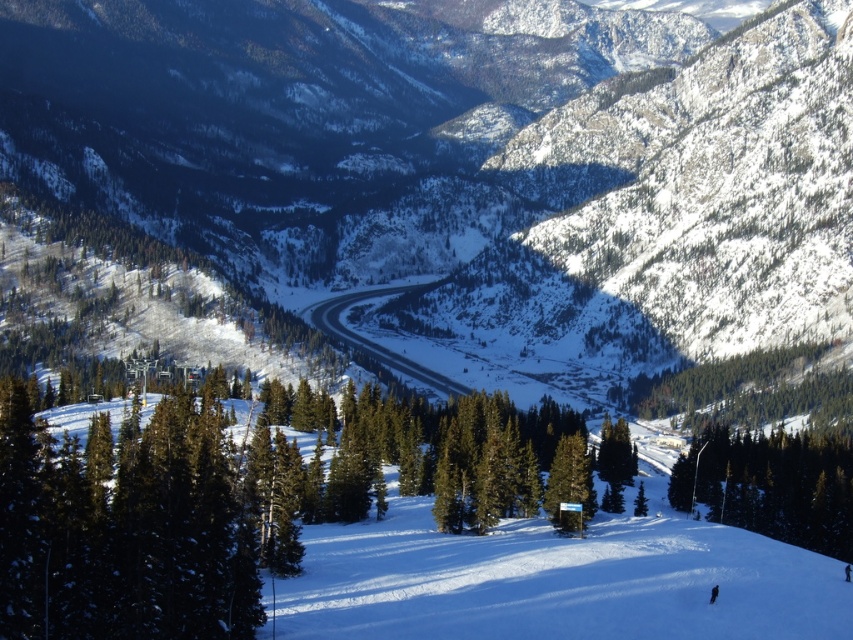
You are standing at the point closer to the camera between the two points, point (793,442) and point (578,435). Which point are you standing at?

You are standing at point (793,442) because it is further to the camera than point (578,435).

You are a hiker planning to cross the winding road in the valley. You need to know if the snowy forested mountain at center is wider than the green textured tree at lower right to decide your path. Can you determine which is wider?

The snowy forested mountain at center might be wider than green textured tree at lower right according to the description provided.